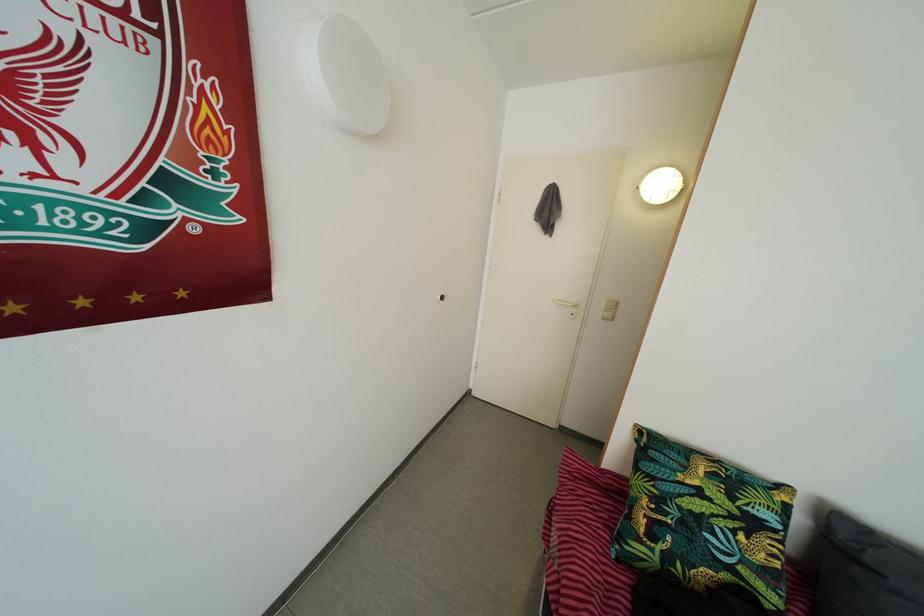
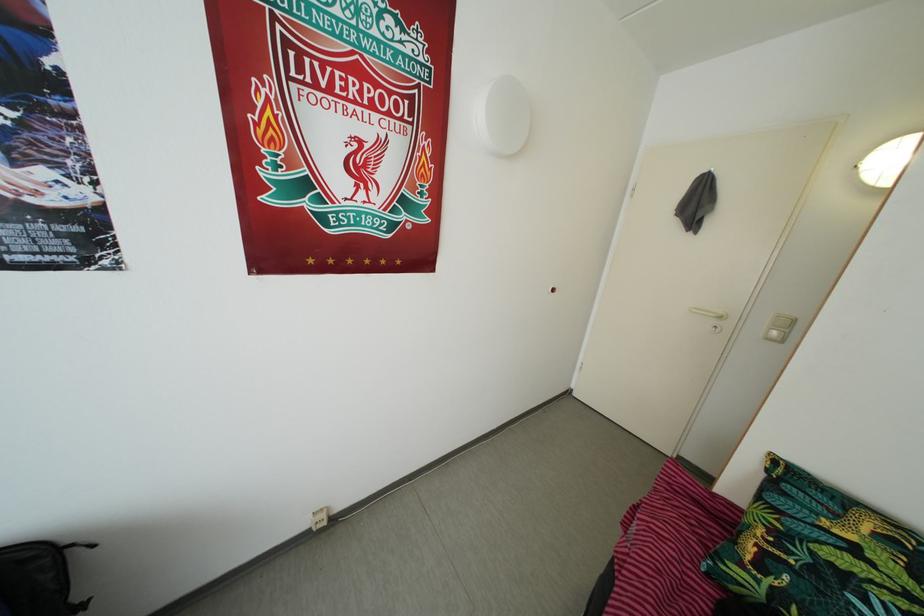
Find the pixel in the second image that matches the point at 554,219 in the first image.

(703, 213)